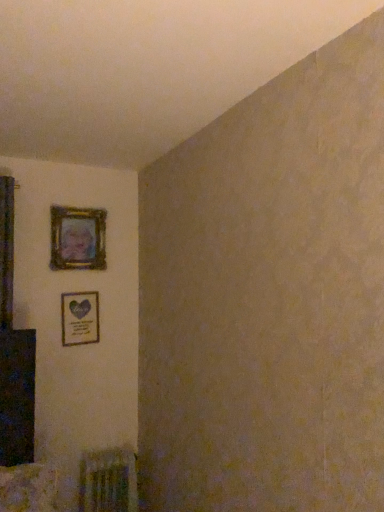
Question: Is matte gold picture frame at upper left, placed as the 2th picture frame when sorted from top to bottom, oriented away from metallic silver radiator at lower left?

Choices:
 (A) no
 (B) yes

Answer: (A)

Question: Can you confirm if matte gold picture frame at upper left, placed as the 2th picture frame when sorted from top to bottom, is bigger than metallic silver radiator at lower left?

Choices:
 (A) yes
 (B) no

Answer: (B)

Question: From the image's perspective, is matte gold picture frame at upper left, arranged as the first picture frame when ordered from the bottom, on top of metallic silver radiator at lower left?

Choices:
 (A) yes
 (B) no

Answer: (A)

Question: Is matte gold picture frame at upper left, placed as the 2th picture frame when sorted from top to bottom, smaller than metallic silver radiator at lower left?

Choices:
 (A) yes
 (B) no

Answer: (A)

Question: Considering the relative positions of matte gold picture frame at upper left, arranged as the first picture frame when ordered from the bottom, and metallic silver radiator at lower left in the image provided, is matte gold picture frame at upper left, arranged as the first picture frame when ordered from the bottom, to the right of metallic silver radiator at lower left from the viewer's perspective?

Choices:
 (A) yes
 (B) no

Answer: (B)

Question: Does matte gold picture frame at upper left, arranged as the first picture frame when ordered from the bottom, lie in front of metallic silver radiator at lower left?

Choices:
 (A) yes
 (B) no

Answer: (B)

Question: Is matte gold picture frame at upper left, placed as the 2th picture frame when sorted from top to bottom, completely or partially inside metallic silver radiator at lower left?

Choices:
 (A) no
 (B) yes

Answer: (A)

Question: Is metallic silver radiator at lower left looking in the opposite direction of matte gold picture frame at upper left, placed as the 2th picture frame when sorted from top to bottom?

Choices:
 (A) no
 (B) yes

Answer: (A)

Question: Is metallic silver radiator at lower left not inside matte gold picture frame at upper left, arranged as the first picture frame when ordered from the bottom?

Choices:
 (A) no
 (B) yes

Answer: (B)

Question: Considering the relative positions of metallic silver radiator at lower left and matte gold picture frame at upper left, arranged as the first picture frame when ordered from the bottom, in the image provided, is metallic silver radiator at lower left to the right of matte gold picture frame at upper left, arranged as the first picture frame when ordered from the bottom, from the viewer's perspective?

Choices:
 (A) yes
 (B) no

Answer: (A)

Question: Is metallic silver radiator at lower left in contact with matte gold picture frame at upper left, placed as the 2th picture frame when sorted from top to bottom?

Choices:
 (A) yes
 (B) no

Answer: (B)

Question: From a real-world perspective, is metallic silver radiator at lower left located beneath matte gold picture frame at upper left, placed as the 2th picture frame when sorted from top to bottom?

Choices:
 (A) no
 (B) yes

Answer: (B)

Question: Does wooden frame at upper left, which ranks as the 1th picture frame in top-to-bottom order, have a larger size compared to metallic silver radiator at lower left?

Choices:
 (A) no
 (B) yes

Answer: (A)